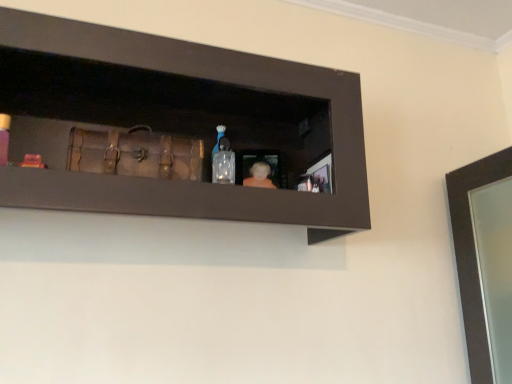
Describe the element at coordinates (174, 127) in the screenshot. I see `brown leather suitcase at center` at that location.

Where is `brown leather suitcase at center`? This screenshot has width=512, height=384. brown leather suitcase at center is located at coordinates (174, 127).

Find the location of `brown leather suitcase at center`. brown leather suitcase at center is located at coordinates pyautogui.click(x=174, y=127).